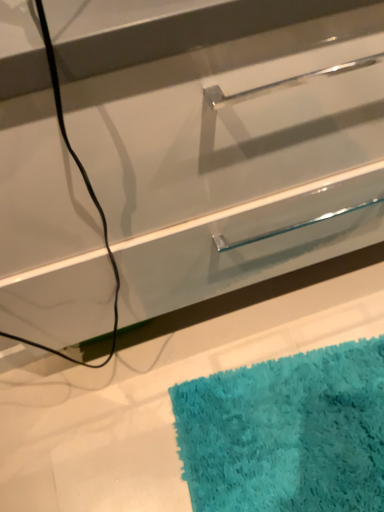
Question: In the image, is clear glass drawer at center positioned in front of or behind turquoise shaggy bath mat at lower right?

Choices:
 (A) behind
 (B) front

Answer: (B)

Question: Visually, is clear glass drawer at center positioned to the left or to the right of turquoise shaggy bath mat at lower right?

Choices:
 (A) right
 (B) left

Answer: (B)

Question: Does point (97, 99) appear closer or farther from the camera than point (332, 462)?

Choices:
 (A) closer
 (B) farther

Answer: (A)

Question: Is point (195, 408) closer or farther from the camera than point (163, 125)?

Choices:
 (A) farther
 (B) closer

Answer: (A)

Question: Based on their sizes in the image, would you say turquoise shaggy bath mat at lower right is bigger or smaller than clear glass drawer at center?

Choices:
 (A) small
 (B) big

Answer: (A)

Question: From a real-world perspective, is turquoise shaggy bath mat at lower right physically located above or below clear glass drawer at center?

Choices:
 (A) above
 (B) below

Answer: (B)

Question: Is turquoise shaggy bath mat at lower right wider or thinner than clear glass drawer at center?

Choices:
 (A) wide
 (B) thin

Answer: (A)